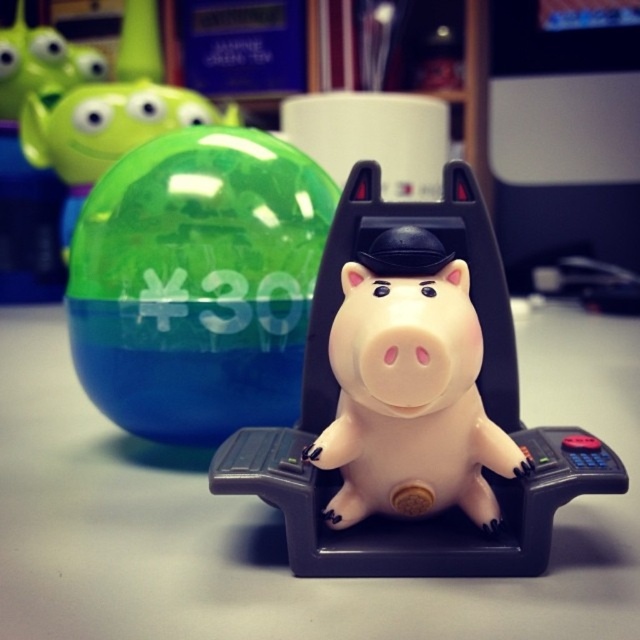
Can you confirm if transparent plastic ball at upper left is positioned to the right of rubber piggy bank at center?

No, transparent plastic ball at upper left is not to the right of rubber piggy bank at center.

Locate an element on the screen. transparent plastic ball at upper left is located at coordinates (196, 282).

Between point (256, 289) and point (88, 122), which one is positioned in front?

Point (256, 289) is in front.

Is point (264, 321) more distant than point (81, 166)?

No, it is in front of (81, 166).

The width and height of the screenshot is (640, 640). What do you see at coordinates (196, 282) in the screenshot? I see `transparent plastic ball at upper left` at bounding box center [196, 282].

In order to click on transparent plastic ball at upper left in this screenshot , I will do `click(196, 282)`.

Is rubber piggy bank at center to the right of satin pink piggy bank at center from the viewer's perspective?

Correct, you'll find rubber piggy bank at center to the right of satin pink piggy bank at center.

I want to click on rubber piggy bank at center, so click(x=481, y=396).

Between point (513, 560) and point (403, 346), which one is positioned in front?

Point (403, 346)

This screenshot has height=640, width=640. In order to click on rubber piggy bank at center in this screenshot , I will do `click(481, 396)`.